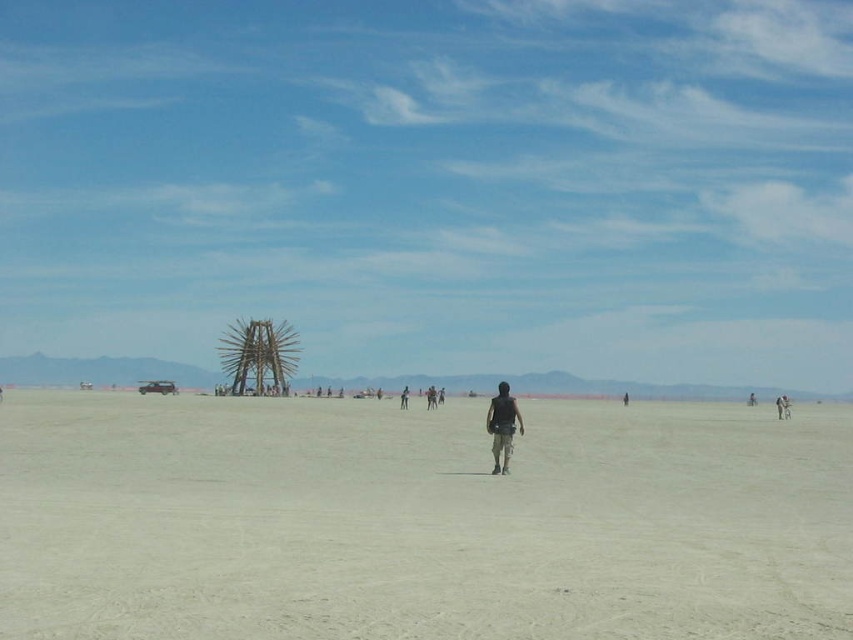
Question: Which of these objects is positioned farthest from the black cotton shirt at center?

Choices:
 (A) dark brown leather jacket at center
 (B) light beige sand at center

Answer: (A)

Question: Does light beige sand at center lie behind black cotton shirt at center?

Choices:
 (A) yes
 (B) no

Answer: (B)

Question: Which point is farther to the camera?

Choices:
 (A) dark brown leather jacket at center
 (B) black cotton shirt at center
 (C) dark gray fabric pants at center

Answer: (C)

Question: Does black cotton shirt at center lie in front of dark brown leather jacket at center?

Choices:
 (A) no
 (B) yes

Answer: (B)

Question: Is black cotton shirt at center in front of dark gray fabric pants at center?

Choices:
 (A) no
 (B) yes

Answer: (B)

Question: Which point is closer to the camera?

Choices:
 (A) dark brown leather jacket at center
 (B) dark gray fabric pants at center
 (C) light beige sand at center
 (D) black cotton shirt at center

Answer: (C)